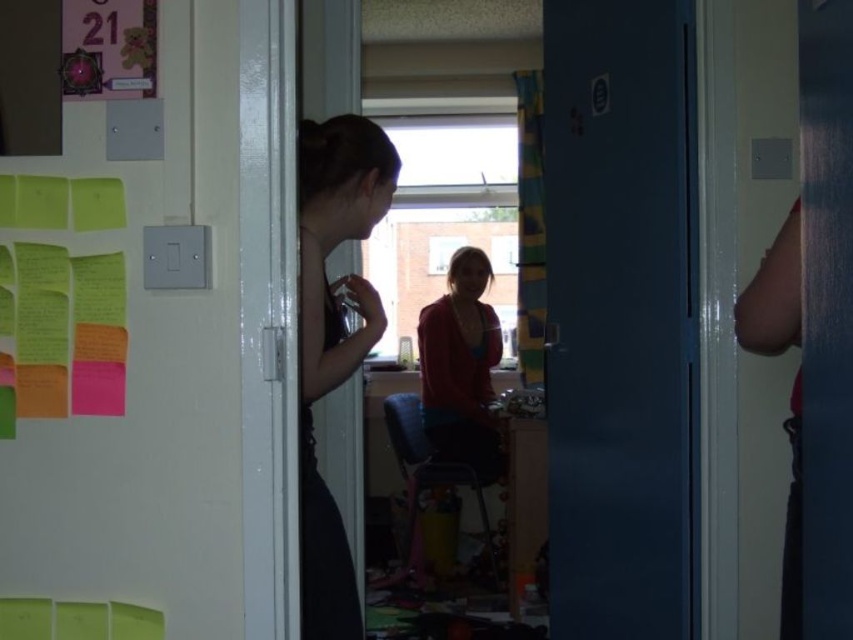
Question: Can you confirm if multicolored sticky notes at left is thinner than matte black hair at center?

Choices:
 (A) no
 (B) yes

Answer: (A)

Question: Which of these objects is positioned farthest from the multicolored sticky notes at left?

Choices:
 (A) matte red sweater at center
 (B) blue matte door at center

Answer: (A)

Question: Which point is closer to the camera taking this photo?

Choices:
 (A) (460, 449)
 (B) (143, 490)
 (C) (102, 198)

Answer: (C)

Question: Can you confirm if blue matte door at center is positioned above matte black hair at center?

Choices:
 (A) yes
 (B) no

Answer: (A)

Question: Among these objects, which one is farthest from the camera?

Choices:
 (A) green paper at upper left
 (B) blue matte door at center

Answer: (B)

Question: Can you confirm if multicolored sticky notes at left is wider than green paper at upper left?

Choices:
 (A) no
 (B) yes

Answer: (B)